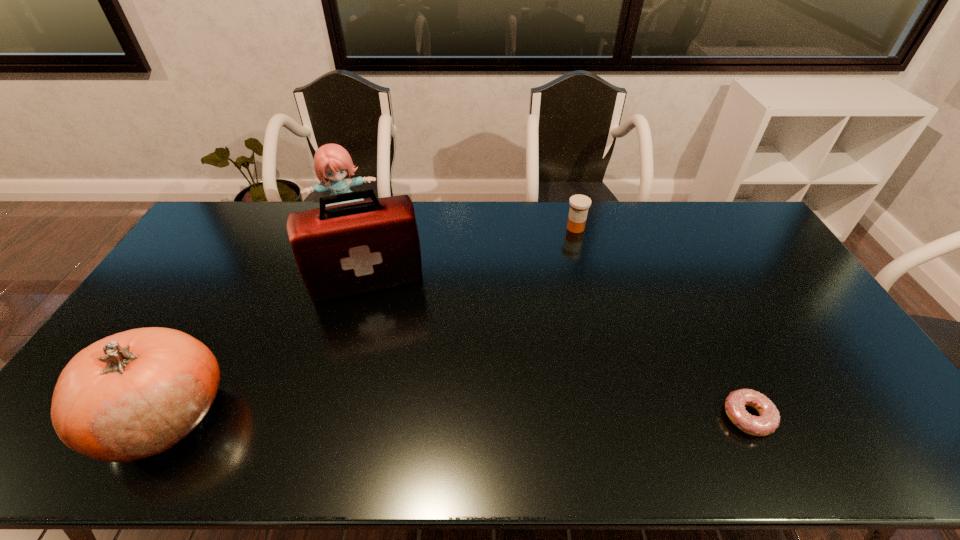
You are a GUI agent. You are given a task and a screenshot of the screen. Output one action in this format:
    pyautogui.click(x=<x>, y=<y>)
    Task: Click on the vacant space located 0.180m on the label of the fourth object from left to right
    The image size is (960, 540).
    Given the screenshot: What is the action you would take?
    pyautogui.click(x=565, y=266)

The height and width of the screenshot is (540, 960). What are the coordinates of `free location located on the label of the fourth object from left to right` in the screenshot? It's located at (564, 272).

At what (x,y) coordinates should I click in order to perform the action: click on free location located 0.220m on the side of the third nearest object with the cross symbol. Please return your answer as a coordinate pair (x, y). Looking at the image, I should click on (389, 363).

You are a GUI agent. You are given a task and a screenshot of the screen. Output one action in this format:
    pyautogui.click(x=<x>, y=<y>)
    Task: Click on the vacant space situated 0.150m on the side of the third nearest object with the cross symbol
    
    Given the screenshot: What is the action you would take?
    pyautogui.click(x=386, y=344)

Find the location of a particular element. This screenshot has width=960, height=540. free location located on the side of the third nearest object with the cross symbol is located at coordinates click(393, 385).

At what (x,y) coordinates should I click in order to perform the action: click on vacant space located 0.400m on the front-facing side of the doll. Please return your answer as a coordinate pair (x, y). This screenshot has height=540, width=960. Looking at the image, I should click on (373, 305).

Where is `vacant space situated 0.230m on the front-facing side of the doll`? The width and height of the screenshot is (960, 540). vacant space situated 0.230m on the front-facing side of the doll is located at coordinates (364, 269).

This screenshot has width=960, height=540. I want to click on vacant space situated on the front-facing side of the doll, so click(368, 284).

The width and height of the screenshot is (960, 540). I want to click on medicine that is positioned at the far edge, so click(579, 204).

Find the location of a particular element. doll that is at the far edge is located at coordinates coord(331,161).